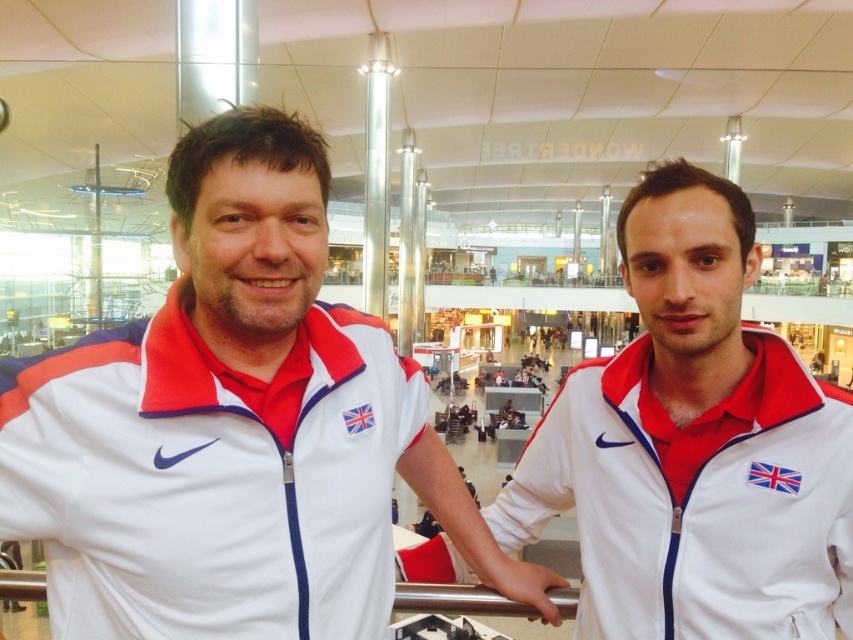
You are a photographer at the airport terminal. You want to take a photo of the white fabric jacket at left and the other person. Where should you position your camera relative to the point marked at coordinates (234, 428) to ensure both subjects are in frame?

The point at (234, 428) corresponds to the white fabric jacket at left. To include both the jacket and the other person in the frame, position the camera so that it is centered around this point and slightly adjusted to include the second individual.

You are a photographer at the airport terminal and need to adjust the camera focus to capture both jackets clearly. Since the white fabric jacket at left and the white fabric jacket at center are different in height, which one should you focus on first to ensure proper depth of field?

The white fabric jacket at left is taller than the white fabric jacket at center, so focusing on the taller jacket first will help ensure proper depth of field for both.

You are a photographer at an airport terminal. You need to position two people wearing white fabric jackets for a photo. The jackets are labeled as white fabric jacket at left and white fabric jacket at center. Based on their positions, which jacket is positioned more to the left?

The white fabric jacket at left is positioned more to the left than the white fabric jacket at center.